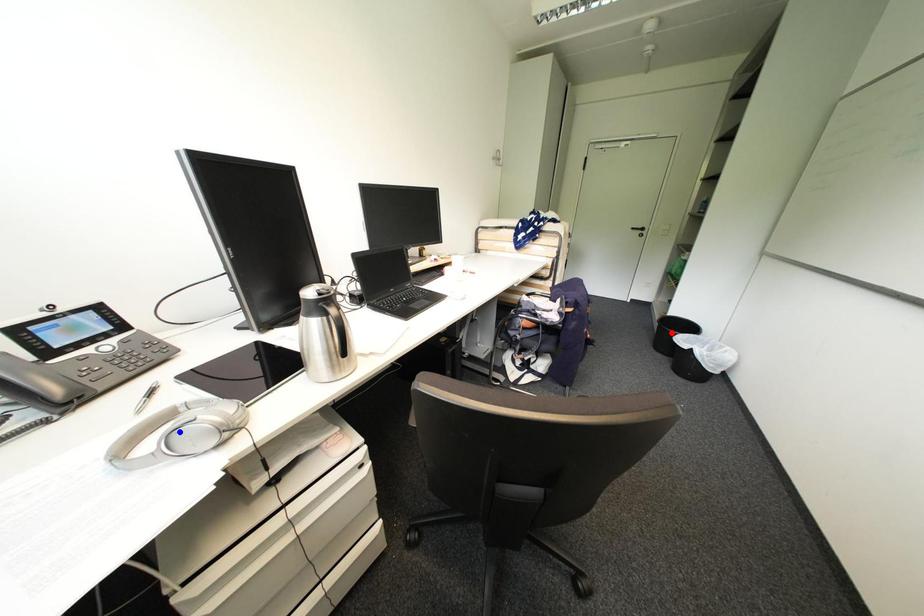
Question: Two points are marked on the image. Which point is closer to the camera?

Choices:
 (A) Blue point is closer.
 (B) Red point is closer.

Answer: (A)